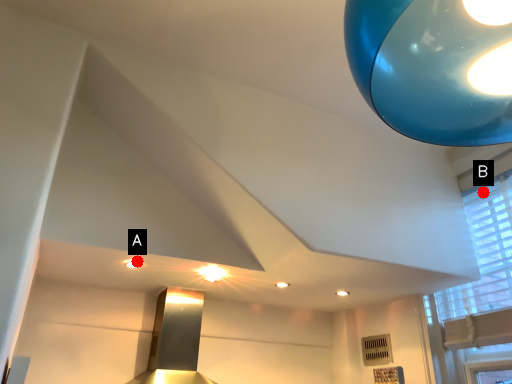
Question: Two points are circled on the image, labeled by A and B beside each circle. Among these points, which one is nearest to the camera?

Choices:
 (A) A is closer
 (B) B is closer

Answer: (A)